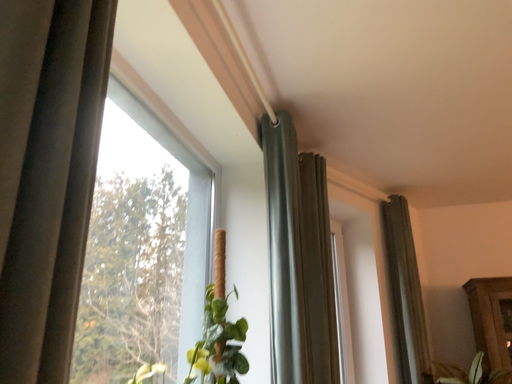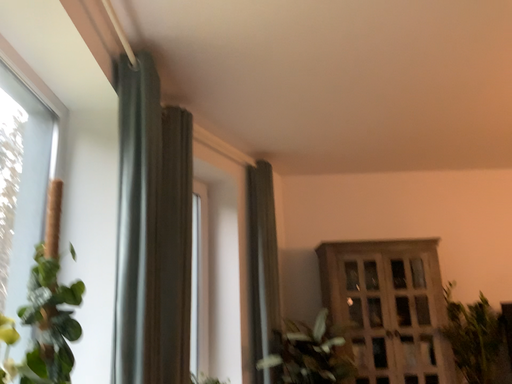
Question: Which way did the camera rotate in the video?

Choices:
 (A) rotated left
 (B) rotated right

Answer: (B)